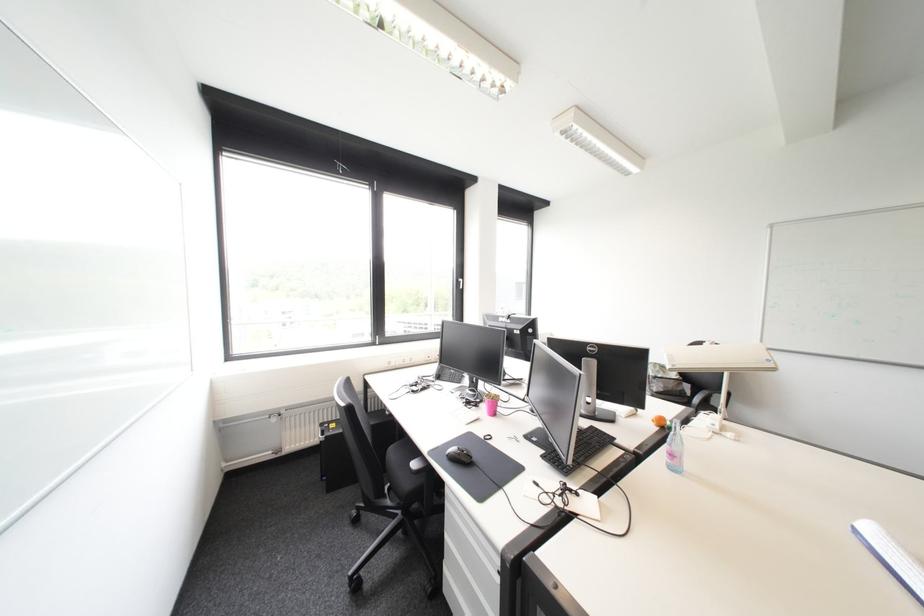
At what (x,y) coordinates should I click in order to perform the action: click on black computer mouse. Please return your answer as a coordinate pair (x, y). This screenshot has height=616, width=924. Looking at the image, I should click on (458, 455).